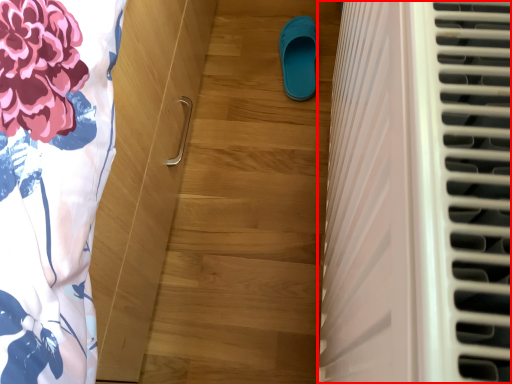
Question: From the image, what is the correct spatial relationship of air conditioning (annotated by the red box) in relation to footwear?

Choices:
 (A) right
 (B) left

Answer: (A)